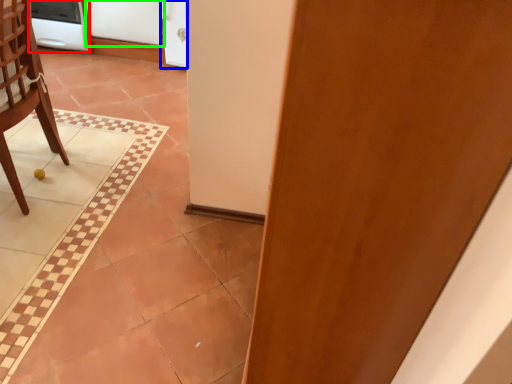
Question: Estimate the real-world distances between objects in this image. Which object is farther from appliance (highlighted by a red box), screen door (highlighted by a blue box) or screen door (highlighted by a green box)?

Choices:
 (A) screen door
 (B) screen door

Answer: (A)